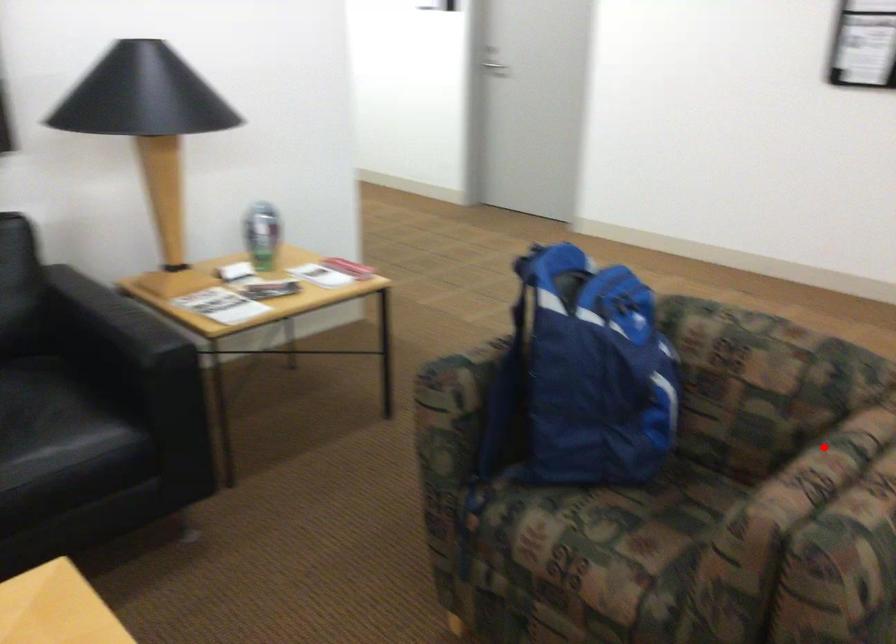
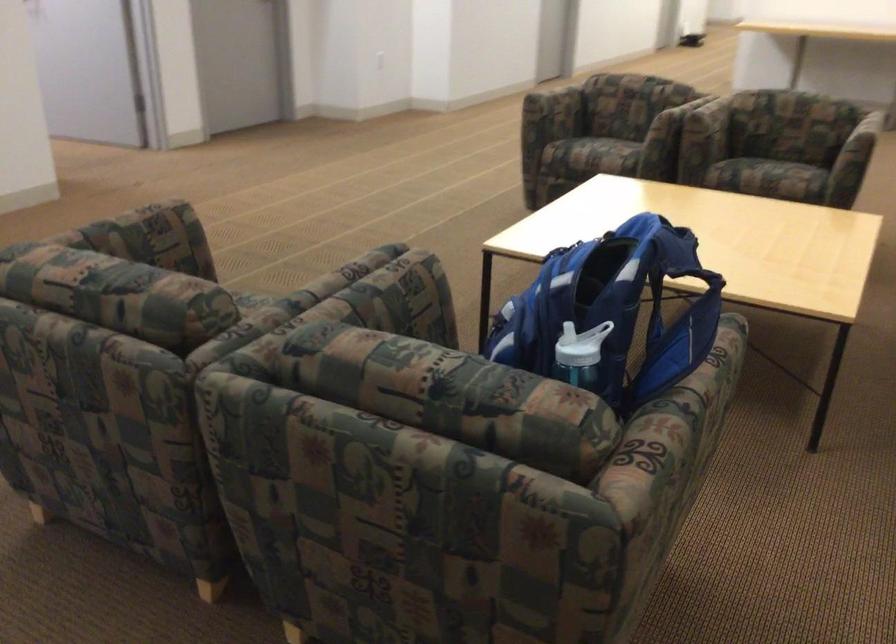
Question: A red point is marked in image1. In image2, is the corresponding 3D point closer to the camera or farther? Reply with the corresponding letter.

Choices:
 (A) The corresponding 3D point is closer.
 (B) The corresponding 3D point is farther.

Answer: (B)